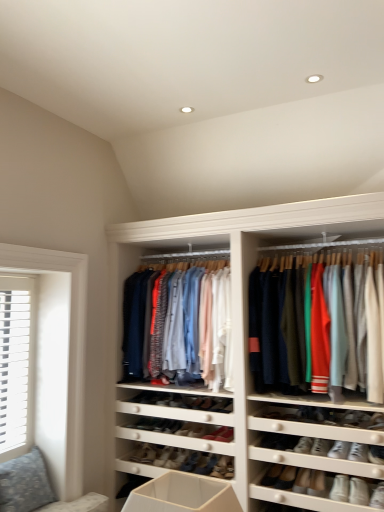
This screenshot has width=384, height=512. I want to click on white slatted wood at left, so click(17, 364).

In order to face matte cotton shirts at center, which ranks as the 1th clothing in left-to-right order, should I rotate leftwards or rightwards?

Turn left approximately 1.329 degrees to face it.

Measure the distance between leather sneaker at center, the 2th shoe when ordered from left to right, and camera.

leather sneaker at center, the 2th shoe when ordered from left to right, is 2.82 meters away from camera.

The width and height of the screenshot is (384, 512). Identify the location of leather sneaker at center, marked as the 1th shoe in a right-to-left arrangement. (176, 458).

Find the location of a particular element. The image size is (384, 512). matte cotton shirts at center, arranged as the 2th clothing when viewed from the left is located at coordinates (320, 328).

From a real-world perspective, is patterned fabric couch at lower left beneath leather sneaker at center, marked as the 1th shoe in a right-to-left arrangement?

No.

Could you tell me if patterned fabric couch at lower left is facing leather sneaker at center, the 1th shoe when ordered from bottom to top?

No.

How many degrees apart are the facing directions of patterned fabric couch at lower left and leather sneaker at center, marked as the 1th shoe in a right-to-left arrangement?

85.1 degrees.

Is leather sneaker at center, the 1th shoe when ordered from bottom to top, directly adjacent to matte cotton shirts at center, arranged as the 2th clothing when viewed from the left?

No, leather sneaker at center, the 1th shoe when ordered from bottom to top, is not next to matte cotton shirts at center, arranged as the 2th clothing when viewed from the left.

How distant is leather sneaker at center, the 1th shoe when ordered from bottom to top, from matte cotton shirts at center, acting as the 1th clothing starting from the right?

A distance of 1.26 meters exists between leather sneaker at center, the 1th shoe when ordered from bottom to top, and matte cotton shirts at center, acting as the 1th clothing starting from the right.

Considering the relative sizes of leather sneaker at center, marked as the 1th shoe in a right-to-left arrangement, and matte cotton shirts at center, arranged as the 2th clothing when viewed from the left, in the image provided, is leather sneaker at center, marked as the 1th shoe in a right-to-left arrangement, smaller than matte cotton shirts at center, arranged as the 2th clothing when viewed from the left,?

Yes.

Considering the sizes of objects matte cotton shirts at center, which ranks as the 1th clothing in left-to-right order, and matte cotton shirts at center, arranged as the 2th clothing when viewed from the left, in the image provided, who is bigger, matte cotton shirts at center, which ranks as the 1th clothing in left-to-right order, or matte cotton shirts at center, arranged as the 2th clothing when viewed from the left,?

matte cotton shirts at center, arranged as the 2th clothing when viewed from the left.

Can you confirm if matte cotton shirts at center, which ranks as the 1th clothing in left-to-right order, is positioned to the left of matte cotton shirts at center, arranged as the 2th clothing when viewed from the left?

Yes, matte cotton shirts at center, which ranks as the 1th clothing in left-to-right order, is to the left of matte cotton shirts at center, arranged as the 2th clothing when viewed from the left.

Who is more distant, matte cotton shirts at center, marked as the 2th clothing in a right-to-left arrangement, or matte cotton shirts at center, acting as the 1th clothing starting from the right?

matte cotton shirts at center, marked as the 2th clothing in a right-to-left arrangement, is behind.

From a real-world perspective, is matte cotton shirts at center, marked as the 2th clothing in a right-to-left arrangement, above or below shiny black shoe at center, placed as the 2th shoe when sorted from right to left?

matte cotton shirts at center, marked as the 2th clothing in a right-to-left arrangement, is situated higher than shiny black shoe at center, placed as the 2th shoe when sorted from right to left, in the real world.

Is matte cotton shirts at center, which ranks as the 1th clothing in left-to-right order, in front of shiny black shoe at center, which is counted as the first shoe, starting from the left?

Yes, matte cotton shirts at center, which ranks as the 1th clothing in left-to-right order, is closer to the camera.

You are a GUI agent. You are given a task and a screenshot of the screen. Output one action in this format:
    pyautogui.click(x=<x>, y=<y>)
    Task: Click on the 2nd clothing directly above the shiny black shoe at center, placed as the 2th shoe when sorted from right to left (from a real-world perspective)
    This screenshot has width=384, height=512.
    Given the screenshot: What is the action you would take?
    (x=181, y=323)

Is point (179, 309) behind point (140, 425)?

That is False.

This screenshot has width=384, height=512. In order to click on the 1st clothing counting from the right of the patterned fabric couch at lower left in this screenshot , I will do `click(181, 323)`.

Is patterned fabric couch at lower left smaller than matte cotton shirts at center, which ranks as the 1th clothing in left-to-right order?

Correct, patterned fabric couch at lower left occupies less space than matte cotton shirts at center, which ranks as the 1th clothing in left-to-right order.

Does patterned fabric couch at lower left have a greater width compared to matte cotton shirts at center, which ranks as the 1th clothing in left-to-right order?

No, patterned fabric couch at lower left is not wider than matte cotton shirts at center, which ranks as the 1th clothing in left-to-right order.

From a real-world perspective, does patterned fabric couch at lower left stand above matte cotton shirts at center, marked as the 2th clothing in a right-to-left arrangement?

Incorrect, from a real-world perspective, patterned fabric couch at lower left is lower than matte cotton shirts at center, marked as the 2th clothing in a right-to-left arrangement.

Would you say matte cotton shirts at center, arranged as the 2th clothing when viewed from the left, contains patterned fabric couch at lower left?

No.

How far apart are matte cotton shirts at center, acting as the 1th clothing starting from the right, and patterned fabric couch at lower left?

matte cotton shirts at center, acting as the 1th clothing starting from the right, and patterned fabric couch at lower left are 5.24 feet apart from each other.

Is matte cotton shirts at center, arranged as the 2th clothing when viewed from the left, taller or shorter than patterned fabric couch at lower left?

Clearly, matte cotton shirts at center, arranged as the 2th clothing when viewed from the left, is taller compared to patterned fabric couch at lower left.

From a real-world perspective, who is located lower, matte cotton shirts at center, arranged as the 2th clothing when viewed from the left, or patterned fabric couch at lower left?

In real-world perspective, patterned fabric couch at lower left is lower.

From the image's perspective, between matte cotton shirts at center, arranged as the 2th clothing when viewed from the left, and leather sneaker at center, the 1th shoe when ordered from bottom to top, which one is located above?

matte cotton shirts at center, arranged as the 2th clothing when viewed from the left, from the image's perspective.

Is matte cotton shirts at center, acting as the 1th clothing starting from the right, oriented away from leather sneaker at center, marked as the 1th shoe in a right-to-left arrangement?

matte cotton shirts at center, acting as the 1th clothing starting from the right, is not turned away from leather sneaker at center, marked as the 1th shoe in a right-to-left arrangement.

In terms of size, does matte cotton shirts at center, acting as the 1th clothing starting from the right, appear bigger or smaller than leather sneaker at center, marked as the 1th shoe in a right-to-left arrangement?

In the image, matte cotton shirts at center, acting as the 1th clothing starting from the right, appears to be larger than leather sneaker at center, marked as the 1th shoe in a right-to-left arrangement.

From a real-world perspective, which is physically above, matte cotton shirts at center, acting as the 1th clothing starting from the right, or leather sneaker at center, marked as the 1th shoe in a right-to-left arrangement?

matte cotton shirts at center, acting as the 1th clothing starting from the right.

At what (x,y) coordinates should I click in order to perform the action: click on couch on the left side of leather sneaker at center, marked as the 1th shoe in a right-to-left arrangement. Please return your answer as a coordinate pair (x, y). This screenshot has height=512, width=384. Looking at the image, I should click on (38, 488).

There is a leather sneaker at center, marked as the 1th shoe in a right-to-left arrangement. Identify the location of the 2nd clothing above it (from the image's perspective). (320, 328).

Which object lies nearer to the anchor point leather sneaker at center, the 2th shoe when ordered from left to right, matte cotton shirts at center, arranged as the 2th clothing when viewed from the left, or shiny black shoe at center, which is counted as the first shoe, starting from the left?

Based on the image, shiny black shoe at center, which is counted as the first shoe, starting from the left, appears to be nearer to leather sneaker at center, the 2th shoe when ordered from left to right.

From the image, which object appears to be farther from leather sneaker at center, which ranks as the second shoe in top-to-bottom order, patterned fabric couch at lower left or white slatted wood at left?

white slatted wood at left.

When comparing their distances from patterned fabric couch at lower left, does matte cotton shirts at center, acting as the 1th clothing starting from the right, or shiny black shoe at center, which is counted as the first shoe, starting from the left, seem closer?

shiny black shoe at center, which is counted as the first shoe, starting from the left, is closer to patterned fabric couch at lower left.

When comparing their distances from white slatted wood at left, does matte cotton shirts at center, arranged as the 2th clothing when viewed from the left, or patterned fabric couch at lower left seem closer?

The object closer to white slatted wood at left is patterned fabric couch at lower left.

Estimate the real-world distances between objects in this image. Which object is closer to leather sneaker at center, the 2th shoe when ordered from left to right, shiny black shoe at center, which is counted as the first shoe, starting from the left, or matte cotton shirts at center, acting as the 1th clothing starting from the right?

shiny black shoe at center, which is counted as the first shoe, starting from the left, lies closer to leather sneaker at center, the 2th shoe when ordered from left to right, than the other object.

Considering their positions, is matte cotton shirts at center, arranged as the 2th clothing when viewed from the left, positioned further to leather sneaker at center, marked as the 1th shoe in a right-to-left arrangement, than matte cotton shirts at center, marked as the 2th clothing in a right-to-left arrangement?

matte cotton shirts at center, arranged as the 2th clothing when viewed from the left.

Consider the image. From the image, which object appears to be nearer to matte cotton shirts at center, arranged as the 2th clothing when viewed from the left, patterned fabric couch at lower left or shiny black shoe at center, which appears as the second shoe when ordered from the bottom?

Among the two, shiny black shoe at center, which appears as the second shoe when ordered from the bottom, is located nearer to matte cotton shirts at center, arranged as the 2th clothing when viewed from the left.

Considering their positions, is patterned fabric couch at lower left positioned closer to shiny black shoe at center, which appears as the second shoe when ordered from the bottom, than leather sneaker at center, the 2th shoe when ordered from left to right?

leather sneaker at center, the 2th shoe when ordered from left to right, is positioned closer to the anchor shiny black shoe at center, which appears as the second shoe when ordered from the bottom.

This screenshot has width=384, height=512. What are the coordinates of `couch between white slatted wood at left and matte cotton shirts at center, acting as the 1th clothing starting from the right, from left to right` in the screenshot? It's located at (38, 488).

Where is `clothing located between patterned fabric couch at lower left and matte cotton shirts at center, arranged as the 2th clothing when viewed from the left, in the left-right direction`? The width and height of the screenshot is (384, 512). clothing located between patterned fabric couch at lower left and matte cotton shirts at center, arranged as the 2th clothing when viewed from the left, in the left-right direction is located at coordinates (181, 323).

The image size is (384, 512). Identify the location of shoe located between patterned fabric couch at lower left and leather sneaker at center, marked as the 1th shoe in a right-to-left arrangement, in the left-right direction. (144, 424).

Locate an element on the screen. The image size is (384, 512). clothing between matte cotton shirts at center, arranged as the 2th clothing when viewed from the left, and leather sneaker at center, the 1th shoe when ordered from bottom to top, in the vertical direction is located at coordinates (181, 323).